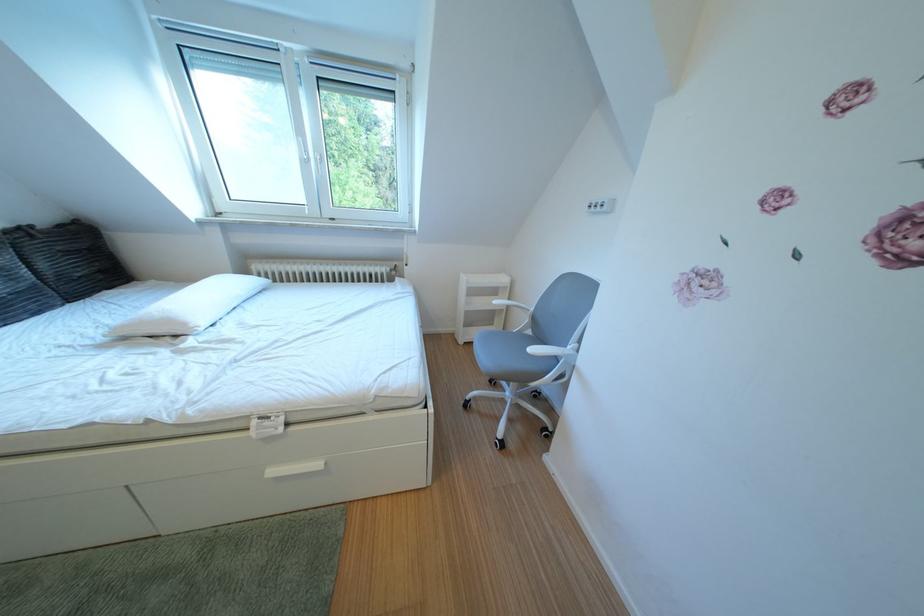
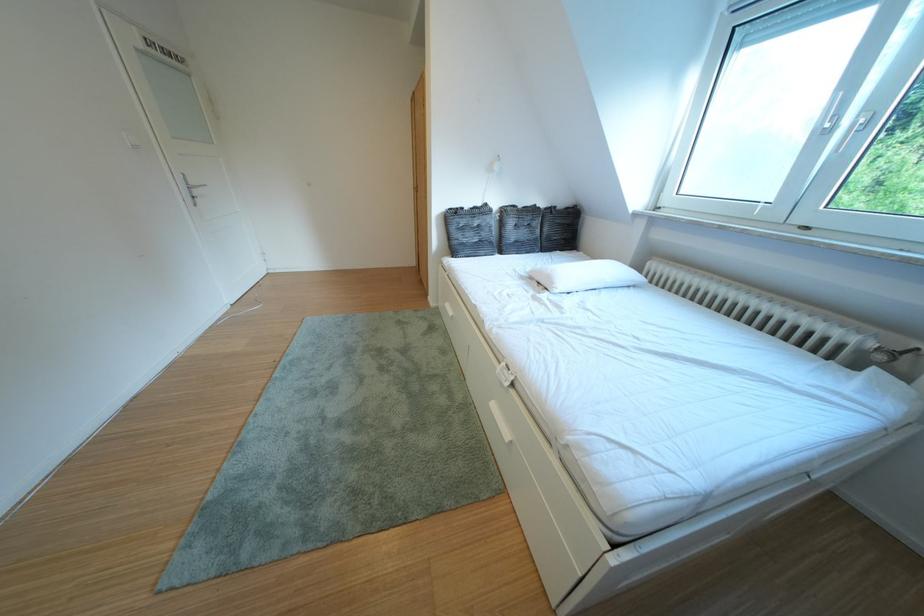
First-person continuous shooting, in which direction is the camera rotating?

The rotation direction of the camera is left-down.